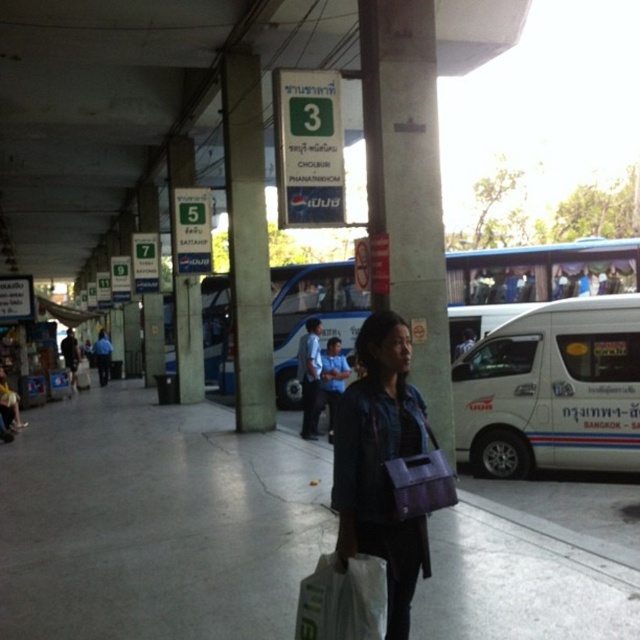
In the scene shown: Between gray concrete pavement at center and concrete pillar at center, which one has less height?

Standing shorter between the two is gray concrete pavement at center.

What do you see at coordinates (156, 522) in the screenshot? This screenshot has width=640, height=640. I see `gray concrete pavement at center` at bounding box center [156, 522].

Is point (29, 458) positioned in front of point (442, 429)?

No.

Locate an element on the screen. The image size is (640, 640). gray concrete pavement at center is located at coordinates (156, 522).

Who is taller, gray concrete pavement at center or blue shirt at center?

With more height is blue shirt at center.

Which is below, gray concrete pavement at center or blue shirt at center?

gray concrete pavement at center is below.

Who is more distant from viewer, (64, 538) or (326, 436)?

Point (326, 436)

This screenshot has height=640, width=640. I want to click on gray concrete pavement at center, so click(156, 522).

Who is positioned more to the left, matte purple bag at center or dark blue jeans at left?

Positioned to the left is dark blue jeans at left.

Who is shorter, matte purple bag at center or dark blue jeans at left?

With less height is matte purple bag at center.

Does point (410, 531) come behind point (65, 340)?

No.

Image resolution: width=640 pixels, height=640 pixels. What are the coordinates of `matte purple bag at center` in the screenshot? It's located at (380, 465).